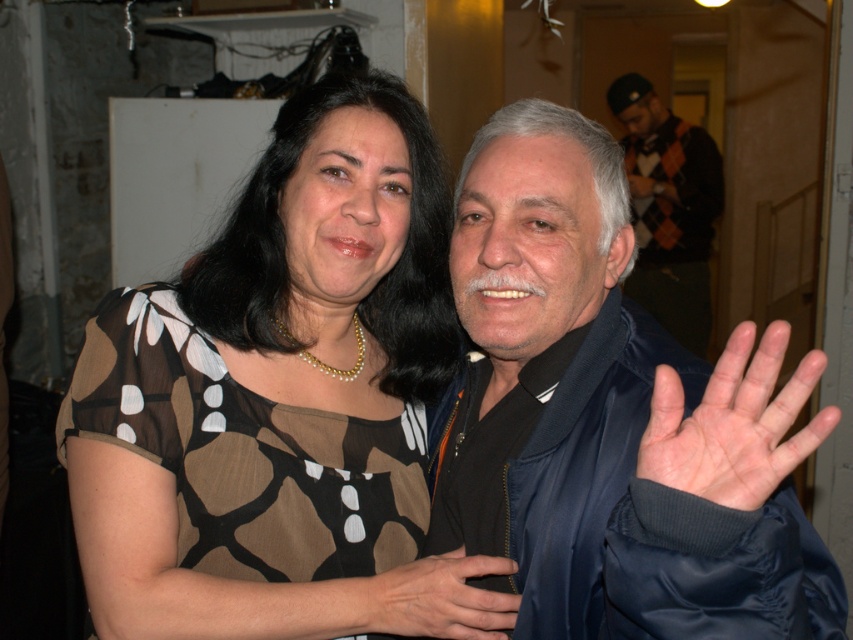
You are standing 1.2 meters away from the camera. There is a point marked at coordinates point (x=386, y=124). Can you reach this point without moving closer to the camera?

The point (x=386, y=124) is 1.07 meters away from the camera. Since you are 1.2 meters away from the camera, you are farther than the point. Therefore, you cannot reach it without moving closer.